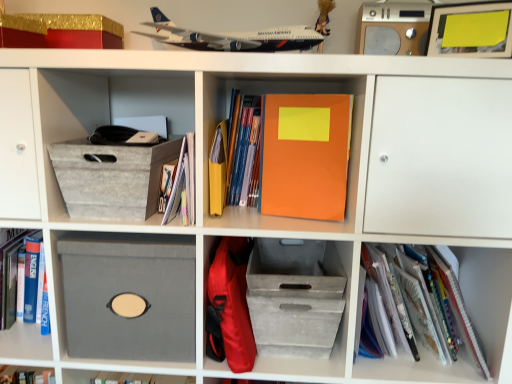
What do you see at coordinates (296, 297) in the screenshot? I see `matte gray storage bin at center` at bounding box center [296, 297].

This screenshot has height=384, width=512. I want to click on white paper notebook at lower right, placed as the third book when sorted from left to right, so click(421, 369).

The image size is (512, 384). Describe the element at coordinates (421, 369) in the screenshot. I see `white paper notebook at lower right, placed as the third book when sorted from left to right` at that location.

The width and height of the screenshot is (512, 384). What are the coordinates of `matte yellow paper at center, the first paperback book from the left` in the screenshot? It's located at (218, 170).

The width and height of the screenshot is (512, 384). I want to click on silver metallic speaker at upper right, so click(x=392, y=28).

Describe the element at coordinates (77, 30) in the screenshot. I see `gold/red cardboard box at upper left` at that location.

Where is `matte blue book at center, the second book when ordered from left to right`? The width and height of the screenshot is (512, 384). matte blue book at center, the second book when ordered from left to right is located at coordinates (238, 155).

Considering the positions of point (273, 149) and point (388, 7), is point (273, 149) closer or farther from the camera than point (388, 7)?

Point (273, 149) is closer to the camera than point (388, 7).

Which of these two, orange matte notebook at center, which ranks as the second paperback book in left-to-right order, or silver metallic speaker at upper right, stands taller?

Standing taller between the two is orange matte notebook at center, which ranks as the second paperback book in left-to-right order.

Considering the relative sizes of orange matte notebook at center, the 1th paperback book when ordered from right to left, and silver metallic speaker at upper right in the image provided, is orange matte notebook at center, the 1th paperback book when ordered from right to left, smaller than silver metallic speaker at upper right?

Indeed, orange matte notebook at center, the 1th paperback book when ordered from right to left, has a smaller size compared to silver metallic speaker at upper right.

Is silver metallic speaker at upper right surrounded by orange matte notebook at center, which ranks as the second paperback book in left-to-right order?

Definitely not — silver metallic speaker at upper right is not inside orange matte notebook at center, which ranks as the second paperback book in left-to-right order.

From the picture: Is gray fabric box at lower left, acting as the 2th cardboard box starting from the top, not near matte yellow paper at center, the first paperback book from the left?

No, gray fabric box at lower left, acting as the 2th cardboard box starting from the top, is not far away from matte yellow paper at center, the first paperback book from the left.

Consider the image. Is the position of gray fabric box at lower left, marked as the 1th cardboard box in a bottom-to-top arrangement, less distant than that of matte yellow paper at center, the first paperback book from the left?

No, gray fabric box at lower left, marked as the 1th cardboard box in a bottom-to-top arrangement, is further to the viewer.

Which of these two, gray fabric box at lower left, marked as the 1th cardboard box in a bottom-to-top arrangement, or matte yellow paper at center, the 2th paperback book positioned from the right, is smaller?

Smaller between the two is matte yellow paper at center, the 2th paperback book positioned from the right.

How many degrees apart are the facing directions of gray fabric box at lower left, acting as the 2th cardboard box starting from the top, and matte yellow paper at center, the first paperback book from the left?

1.86 degrees separate the facing orientations of gray fabric box at lower left, acting as the 2th cardboard box starting from the top, and matte yellow paper at center, the first paperback book from the left.

Is gold/red cardboard box at upper left located within matte blue book at center, the second book when ordered from left to right?

No, gold/red cardboard box at upper left is located outside of matte blue book at center, the second book when ordered from left to right.

How much distance is there between matte blue book at center, the second book when ordered from left to right, and gold/red cardboard box at upper left?

15.93 inches.

From a real-world perspective, between matte blue book at center, the second book when ordered from left to right, and gold/red cardboard box at upper left, who is vertically lower?

matte blue book at center, the second book when ordered from left to right.

Who is taller, matte blue book at center, which is counted as the second book, starting from the right, or gold/red cardboard box at upper left?

Standing taller between the two is matte blue book at center, which is counted as the second book, starting from the right.

This screenshot has width=512, height=384. Identify the location of storage box located on the left of gray fabric storage box at left, the 2th cardboard box positioned from the bottom. (77, 30).

Can you confirm if gray fabric storage box at left, the 2th cardboard box positioned from the bottom, is positioned to the right of gold/red cardboard box at upper left?

Indeed, gray fabric storage box at left, the 2th cardboard box positioned from the bottom, is positioned on the right side of gold/red cardboard box at upper left.

Does gray fabric storage box at left, the 2th cardboard box positioned from the bottom, contain gold/red cardboard box at upper left?

No, gold/red cardboard box at upper left is located outside of gray fabric storage box at left, the 2th cardboard box positioned from the bottom.

From the image's perspective, would you say gray fabric storage box at left, the 2th cardboard box positioned from the bottom, is shown under gold/red cardboard box at upper left?

Correct, gray fabric storage box at left, the 2th cardboard box positioned from the bottom, appears lower than gold/red cardboard box at upper left in the image.

From a real-world perspective, is white plastic airplane at upper center above or below matte blue book at center, which is counted as the second book, starting from the right?

Clearly, from a real-world perspective, white plastic airplane at upper center is above matte blue book at center, which is counted as the second book, starting from the right.

Does white plastic airplane at upper center have a lesser height compared to matte blue book at center, the second book when ordered from left to right?

Indeed, white plastic airplane at upper center has a lesser height compared to matte blue book at center, the second book when ordered from left to right.

How different are the orientations of white plastic airplane at upper center and matte blue book at center, which is counted as the second book, starting from the right, in degrees?

The angular difference between white plastic airplane at upper center and matte blue book at center, which is counted as the second book, starting from the right, is 68.4 degrees.

Considering the sizes of objects white plastic airplane at upper center and matte blue book at center, the second book when ordered from left to right, in the image provided, who is thinner, white plastic airplane at upper center or matte blue book at center, the second book when ordered from left to right,?

matte blue book at center, the second book when ordered from left to right, is thinner.

Is silver metallic speaker at upper right outside of gray fabric box at lower left, acting as the 2th cardboard box starting from the top?

Yes, silver metallic speaker at upper right is outside of gray fabric box at lower left, acting as the 2th cardboard box starting from the top.

How many degrees apart are the facing directions of silver metallic speaker at upper right and gray fabric box at lower left, marked as the 1th cardboard box in a bottom-to-top arrangement?

2.16 degrees.

Is silver metallic speaker at upper right further to camera compared to gray fabric box at lower left, acting as the 2th cardboard box starting from the top?

Yes, silver metallic speaker at upper right is further from the camera.

Which of these two, matte orange folder at center, placed as the 3th book when sorted from right to left, or white plastic airplane at upper center, is smaller?

Smaller between the two is matte orange folder at center, placed as the 3th book when sorted from right to left.

Considering the sizes of objects matte orange folder at center, placed as the 3th book when sorted from right to left, and white plastic airplane at upper center in the image provided, who is thinner, matte orange folder at center, placed as the 3th book when sorted from right to left, or white plastic airplane at upper center?

With smaller width is matte orange folder at center, placed as the 3th book when sorted from right to left.

From a real-world perspective, count 2nd books downward from the white plastic airplane at upper center and point to it. Please provide its 2D coordinates.

[(180, 178)]

Which point is more distant from viewer, (183,141) or (192,49)?

Point (183,141)

This screenshot has height=384, width=512. In order to click on the 1st paperback book positioned below the silver metallic speaker at upper right (from the image's perspective) in this screenshot , I will do `click(305, 155)`.

Identify the location of cardboard box behind the matte yellow paper at center, the 2th paperback book positioned from the right. This screenshot has width=512, height=384. (130, 293).

When comparing their distances from gray fabric box at lower left, acting as the 2th cardboard box starting from the top, does matte gray storage bin at center or white paper notebook at lower right, the first book positioned from the right, seem closer?

matte gray storage bin at center lies closer to gray fabric box at lower left, acting as the 2th cardboard box starting from the top, than the other object.

Which object lies nearer to the anchor point matte yellow paper at center, the 2th paperback book positioned from the right, matte blue book at center, which is counted as the second book, starting from the right, or matte gray storage bin at center?

matte blue book at center, which is counted as the second book, starting from the right.

Based on their spatial positions, is gray fabric storage box at left, the 2th cardboard box positioned from the bottom, or silver metallic speaker at upper right further from gray fabric box at lower left, marked as the 1th cardboard box in a bottom-to-top arrangement?

silver metallic speaker at upper right is further to gray fabric box at lower left, marked as the 1th cardboard box in a bottom-to-top arrangement.

Estimate the real-world distances between objects in this image. Which object is further from gold/red cardboard box at upper left, white plastic airplane at upper center or gray fabric storage box at left, acting as the first cardboard box starting from the top?

gray fabric storage box at left, acting as the first cardboard box starting from the top, is further to gold/red cardboard box at upper left.

Which object lies further to the anchor point gray fabric box at lower left, marked as the 1th cardboard box in a bottom-to-top arrangement, matte orange folder at center, placed as the 3th book when sorted from right to left, or silver metallic speaker at upper right?

Among the two, silver metallic speaker at upper right is located further to gray fabric box at lower left, marked as the 1th cardboard box in a bottom-to-top arrangement.

From the image, which object appears to be farther from matte blue book at center, which is counted as the second book, starting from the right, gray fabric box at lower left, acting as the 2th cardboard box starting from the top, or gold/red cardboard box at upper left?

The object further to matte blue book at center, which is counted as the second book, starting from the right, is gold/red cardboard box at upper left.

Consider the image. Estimate the real-world distances between objects in this image. Which object is further from white paper notebook at lower right, the first book positioned from the right, matte yellow paper at center, the first paperback book from the left, or matte blue book at center, the second book when ordered from left to right?

Among the two, matte yellow paper at center, the first paperback book from the left, is located further to white paper notebook at lower right, the first book positioned from the right.

Based on their spatial positions, is gold/red cardboard box at upper left or white plastic airplane at upper center further from matte blue book at center, the second book when ordered from left to right?

gold/red cardboard box at upper left is further to matte blue book at center, the second book when ordered from left to right.

The width and height of the screenshot is (512, 384). I want to click on shelf between gray fabric storage box at left, the 2th cardboard box positioned from the bottom, and white paper notebook at lower right, the first book positioned from the right, in the horizontal direction, so click(296, 297).

This screenshot has height=384, width=512. In order to click on book that lies between orange matte notebook at center, which ranks as the second paperback book in left-to-right order, and matte gray storage bin at center from top to bottom in this screenshot , I will do `click(180, 178)`.

You are a GUI agent. You are given a task and a screenshot of the screen. Output one action in this format:
    pyautogui.click(x=<x>, y=<y>)
    Task: Click on the book between matte orange folder at center, placed as the 3th book when sorted from right to left, and orange matte notebook at center, the 1th paperback book when ordered from right to left, from left to right
    This screenshot has height=384, width=512.
    Given the screenshot: What is the action you would take?
    pyautogui.click(x=238, y=155)

Locate an element on the screen. The width and height of the screenshot is (512, 384). paperback book that lies between white plastic airplane at upper center and matte yellow paper at center, the first paperback book from the left, from top to bottom is located at coordinates (305, 155).